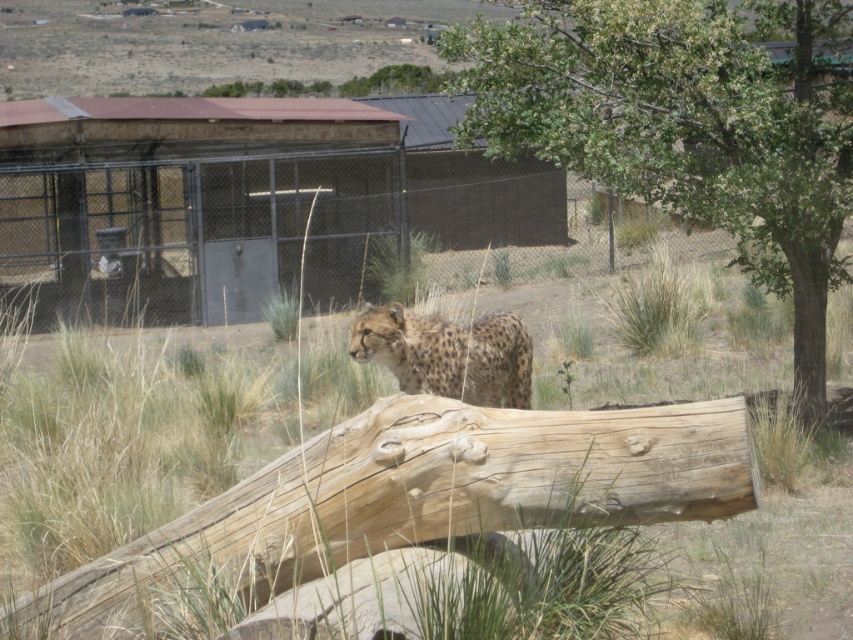
You are a wildlife photographer aiming to capture the spotted fur cheetah at center in a frame where it appears taller than the green leafy tree at upper right. Based on their current positions, is this possible?

The green leafy tree at upper right has a lesser height compared to spotted fur cheetah at center, so the spotted fur cheetah at center already appears taller than the green leafy tree at upper right in the current positions.

You are a wildlife photographer observing the scene. You notice the green grass at center and the spotted fur cheetah at center. Which object is taller in this environment?

The green grass at center is much taller than the spotted fur cheetah at center.